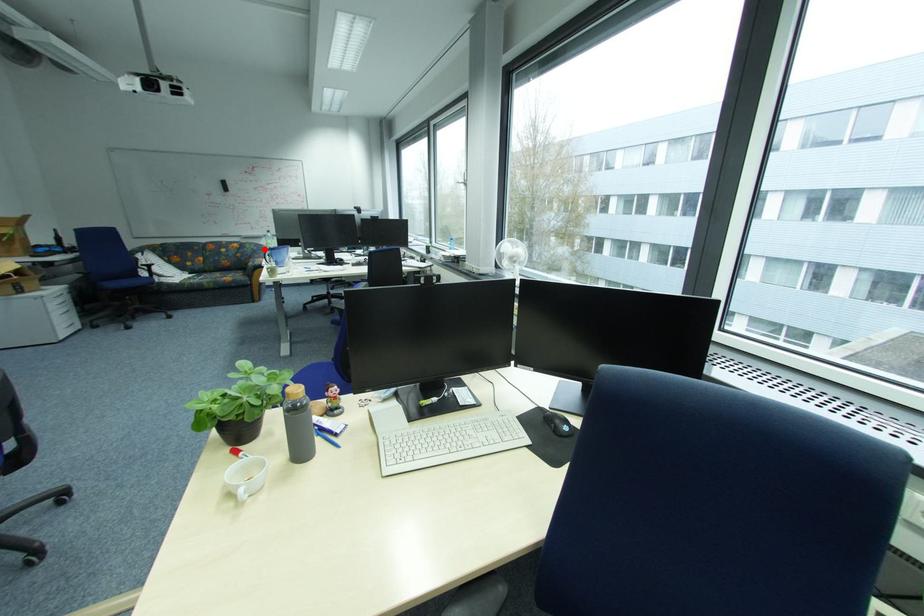
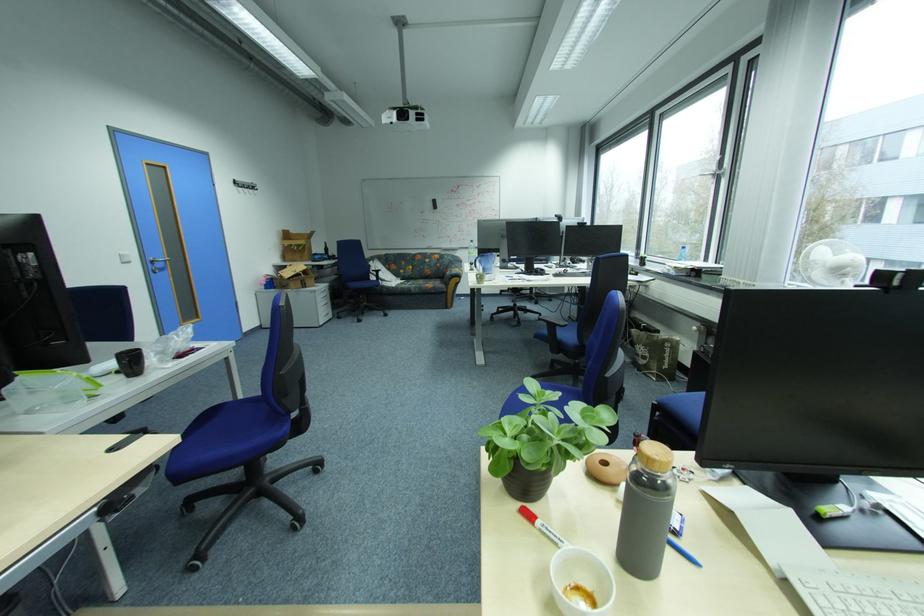
Question: I am providing you with two images of the same scene from different viewpoints. A red point is shown in image1. For the corresponding object point in image2, is it positioned nearer or farther from the camera?

Choices:
 (A) Nearer
 (B) Farther

Answer: (A)